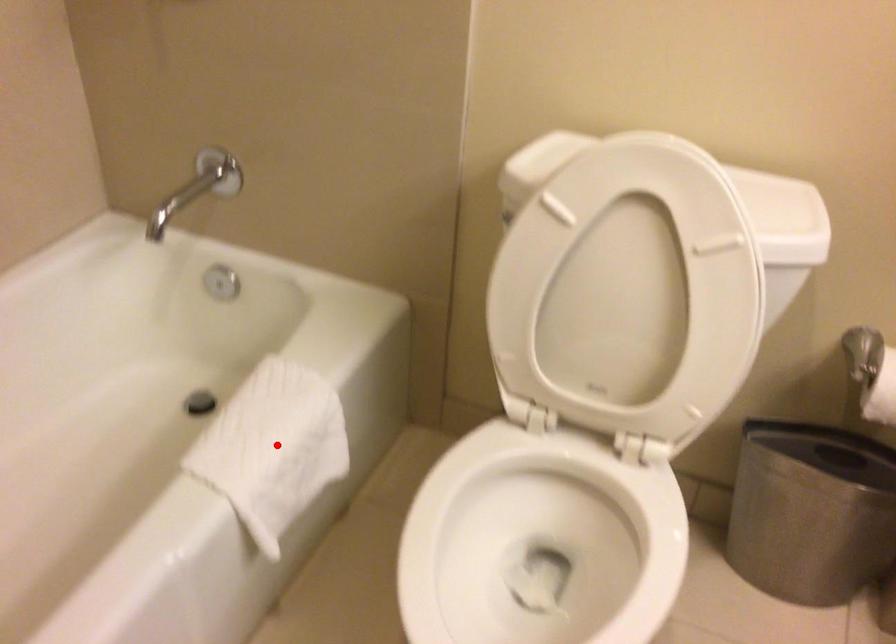
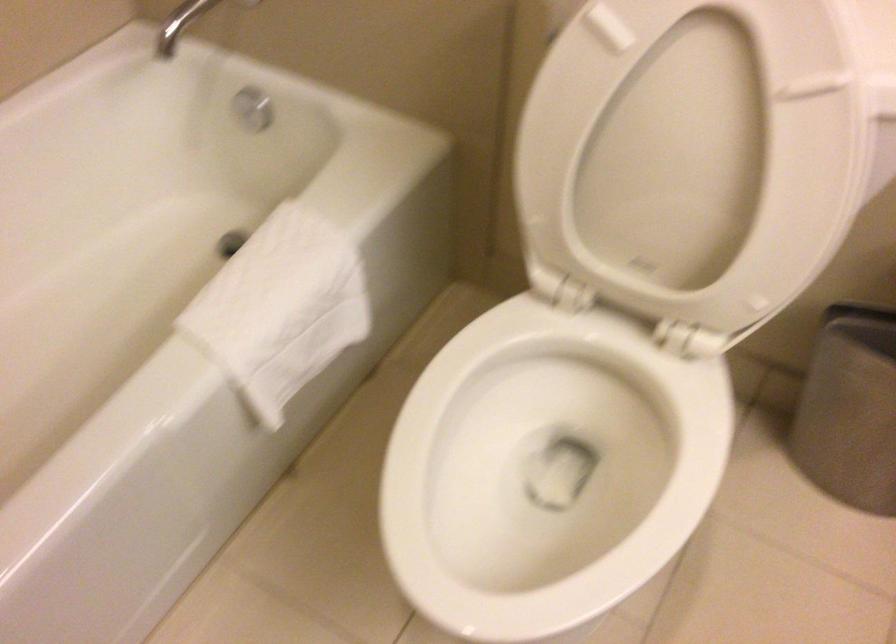
Question: A red point is marked in image1. In image2, is the corresponding 3D point closer to the camera or farther? Reply with the corresponding letter.

Choices:
 (A) The corresponding 3D point is closer.
 (B) The corresponding 3D point is farther.

Answer: (A)